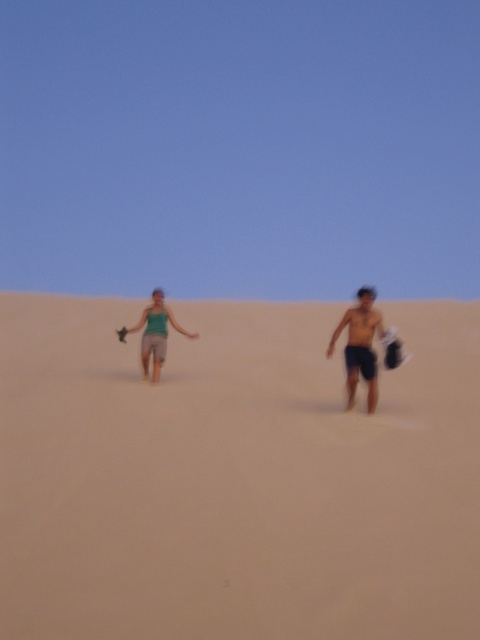
Question: Can you confirm if beige sandy beach at center is wider than matte green tank top at center?

Choices:
 (A) no
 (B) yes

Answer: (B)

Question: Among these points, which one is nearest to the camera?

Choices:
 (A) (168, 310)
 (B) (152, 627)
 (C) (354, 396)

Answer: (B)

Question: Is beige sandy beach at center above shiny black shorts at center?

Choices:
 (A) yes
 (B) no

Answer: (B)

Question: Estimate the real-world distances between objects in this image. Which object is closer to the matte green tank top at center?

Choices:
 (A) beige sandy beach at center
 (B) shiny black shorts at center

Answer: (B)

Question: Does shiny black shorts at center have a larger size compared to matte green tank top at center?

Choices:
 (A) no
 (B) yes

Answer: (A)

Question: Which point is closer to the camera taking this photo?

Choices:
 (A) (121, 333)
 (B) (370, 300)
 (C) (408, 403)

Answer: (B)